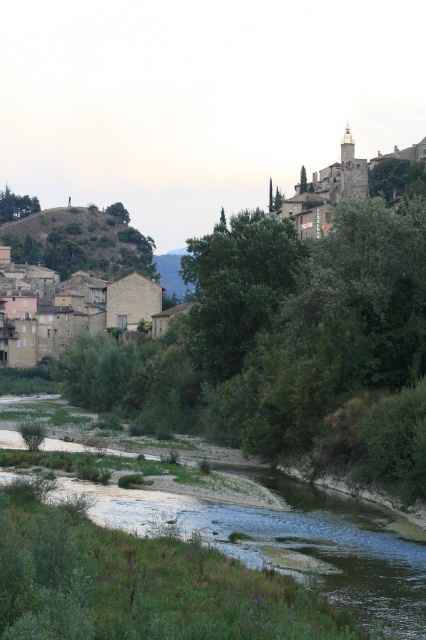
Based on the photo, you are an architect planning to build a new observation deck in this rural landscape. The deck must provide a view of both the stone tower at upper right and the green leafy tree at upper center. Based on their heights, which structure would you place the deck closer to to ensure both are visible?

The stone tower at upper right is taller than the green leafy tree at upper center. To ensure both are visible from the observation deck, the deck should be placed closer to the shorter green leafy tree at upper center so that the taller stone tower at upper right can still be seen over it.

You are a hiker standing at the riverbank and want to reach the village located on the hillside. Which direction should you walk to get there faster, towards the green grassy hillside at upper left or the green leafy tree at upper right?

The green grassy hillside at upper left is wider than the green leafy tree at upper right, so walking towards the green grassy hillside at upper left would be faster as it covers more ground.